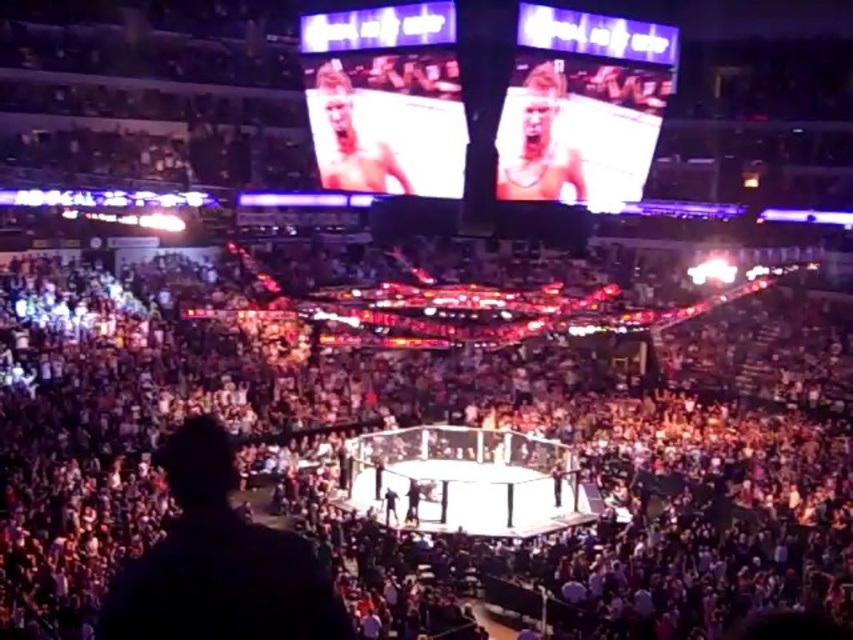
Question: Which point appears closest to the camera in this image?

Choices:
 (A) (590, 458)
 (B) (526, 84)
 (C) (329, 116)

Answer: (B)

Question: Does dark gray crowd at center have a greater width compared to smooth skin face at upper right?

Choices:
 (A) no
 (B) yes

Answer: (B)

Question: Estimate the real-world distances between objects in this image. Which object is closer to the dark gray crowd at center?

Choices:
 (A) smooth skin face at upper right
 (B) smooth skin face at upper center

Answer: (B)

Question: Which of these objects is positioned closest to the dark gray crowd at center?

Choices:
 (A) smooth skin face at upper right
 (B) smooth skin face at upper center

Answer: (B)

Question: Is dark gray crowd at center smaller than smooth skin face at upper right?

Choices:
 (A) yes
 (B) no

Answer: (B)

Question: Does dark gray crowd at center have a greater width compared to smooth skin face at upper center?

Choices:
 (A) yes
 (B) no

Answer: (A)